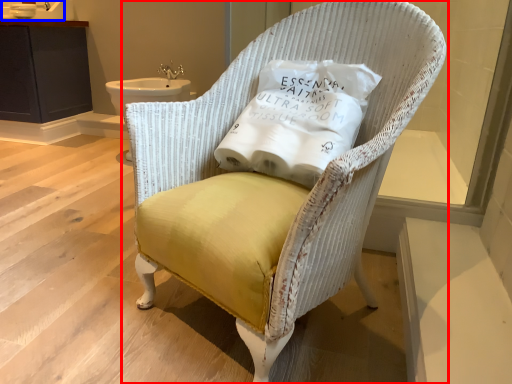
Question: Which object is further to the camera taking this photo, chair (highlighted by a red box) or sink (highlighted by a blue box)?

Choices:
 (A) chair
 (B) sink

Answer: (B)